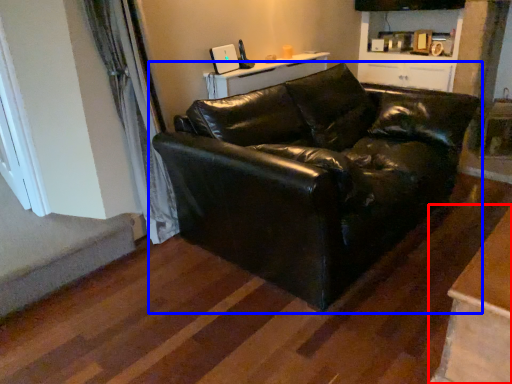
Question: Which object appears farthest to the camera in this image, table (highlighted by a red box) or studio couch (highlighted by a blue box)?

Choices:
 (A) table
 (B) studio couch

Answer: (B)